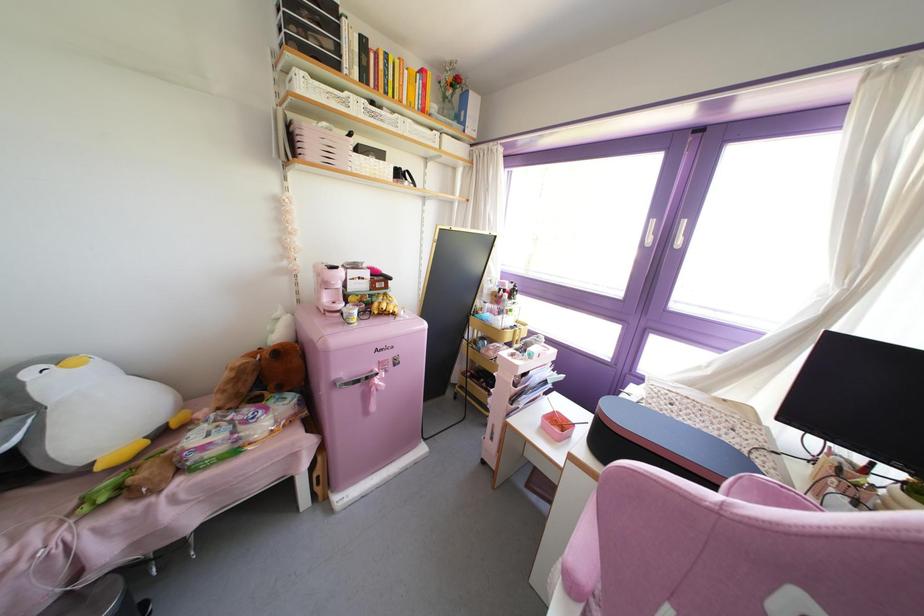
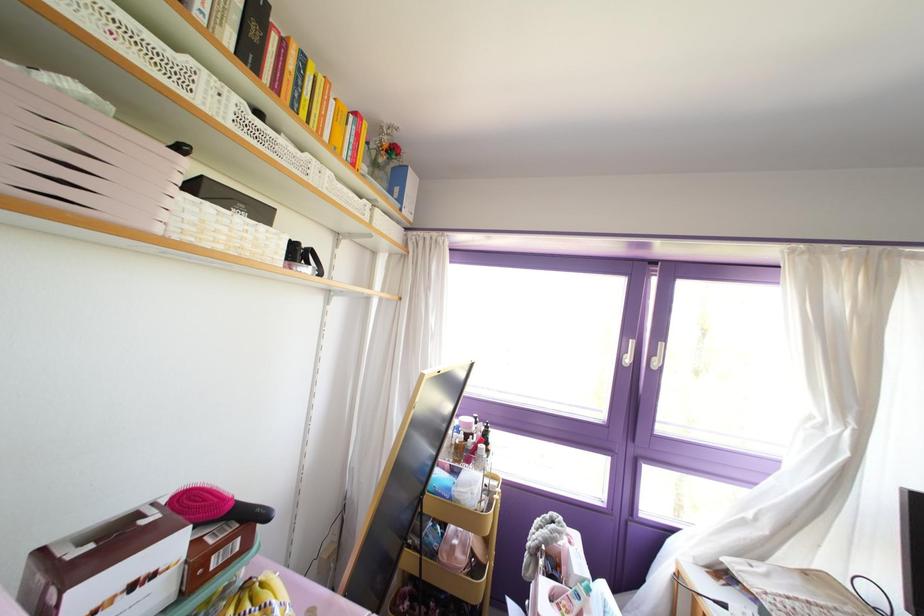
Question: The camera is either moving clockwise (left) or counter-clockwise (right) around the object. The first image is from the beginning of the video and the second image is from the end. Is the camera moving left or right when shooting the video?

Choices:
 (A) Left
 (B) Right

Answer: (A)